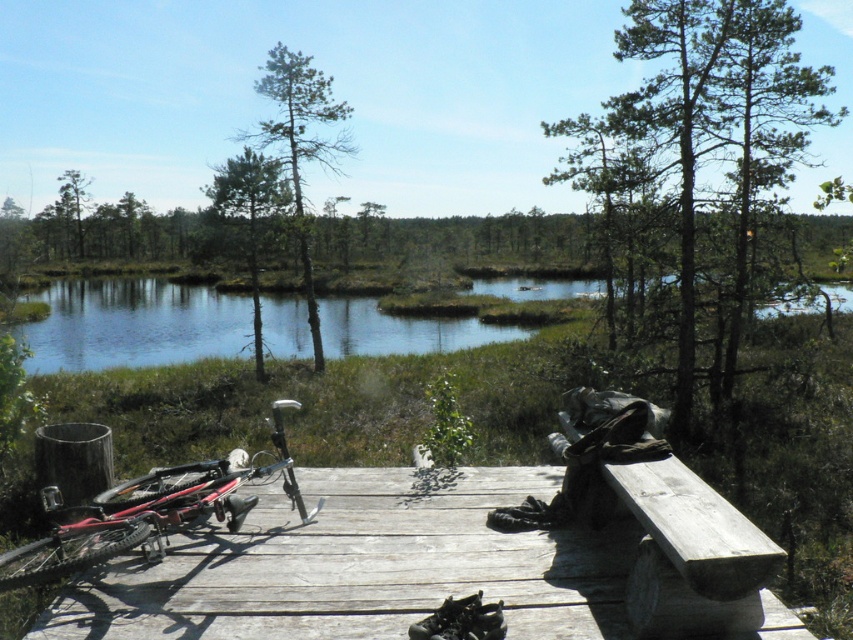
Between wooden dock at lower left and red matte mountain bike at lower left, which one is positioned higher?

red matte mountain bike at lower left

Is point (485, 593) positioned behind point (189, 492)?

That is False.

Where is `wooden dock at lower left`? wooden dock at lower left is located at coordinates (444, 564).

Does point (144, 506) come farther from viewer compared to point (666, 552)?

Yes, it is.

The width and height of the screenshot is (853, 640). Describe the element at coordinates (149, 515) in the screenshot. I see `red matte mountain bike at lower left` at that location.

Is point (167, 470) closer to viewer compared to point (728, 572)?

No.

You are a GUI agent. You are given a task and a screenshot of the screen. Output one action in this format:
    pyautogui.click(x=<x>, y=<y>)
    Task: Click on the red matte mountain bike at lower left
    This screenshot has width=853, height=640.
    Given the screenshot: What is the action you would take?
    pyautogui.click(x=149, y=515)

Is wooden dock at lower left further to the viewer compared to weathered wood bench at lower right?

That is True.

Locate an element on the screen. wooden dock at lower left is located at coordinates (444, 564).

Is point (546, 586) farther from viewer compared to point (759, 544)?

Yes, point (546, 586) is behind point (759, 544).

Where is `wooden dock at lower left`? wooden dock at lower left is located at coordinates (444, 564).